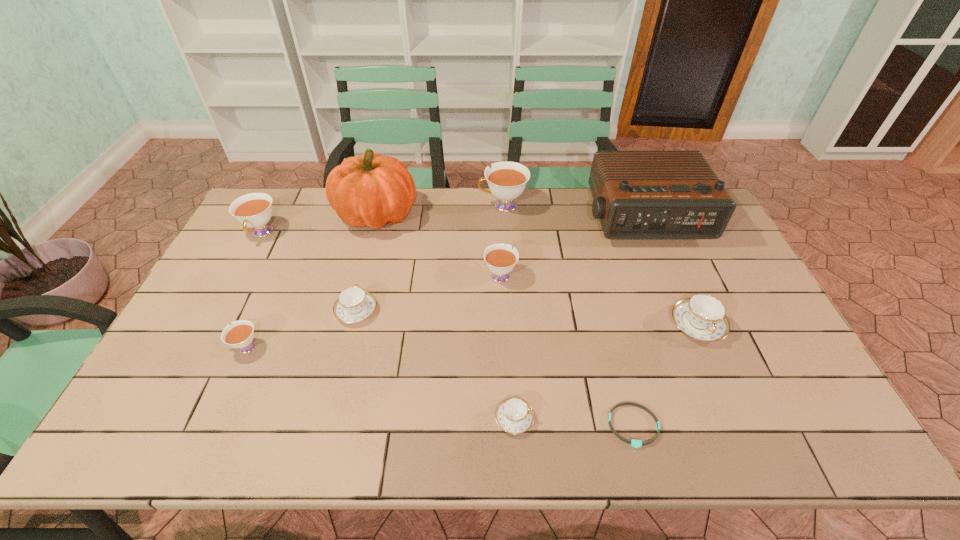
This screenshot has height=540, width=960. I want to click on the rightmost blue teacup, so click(702, 317).

Where is `the biggest blue teacup`? The width and height of the screenshot is (960, 540). the biggest blue teacup is located at coordinates coord(702,317).

The image size is (960, 540). What are the coordinates of `the nearest white teacup` in the screenshot? It's located at (240, 335).

Identify the location of the third white teacup from right to left. The width and height of the screenshot is (960, 540). (240, 335).

Find the location of `the second smallest blue teacup`. the second smallest blue teacup is located at coordinates (x=353, y=305).

At what (x,y) coordinates should I click in order to perform the action: click on the leftmost blue teacup. Please return your answer as a coordinate pair (x, y). Looking at the image, I should click on (353, 305).

Find the location of a particular element. Image resolution: width=960 pixels, height=540 pixels. the shortest teacup is located at coordinates (514, 415).

I want to click on the second blue teacup from left to right, so click(x=514, y=415).

In order to click on gray wristband in this screenshot , I will do `click(634, 443)`.

Find the location of `the shortest object`. the shortest object is located at coordinates (634, 443).